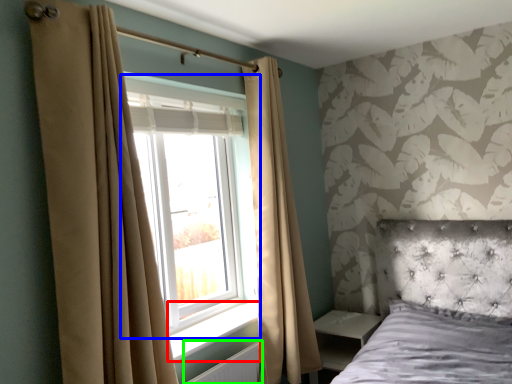
Question: Which is farther away from window sill (highlighted by a red box)? window (highlighted by a blue box) or radiator (highlighted by a green box)?

Choices:
 (A) window
 (B) radiator

Answer: (A)